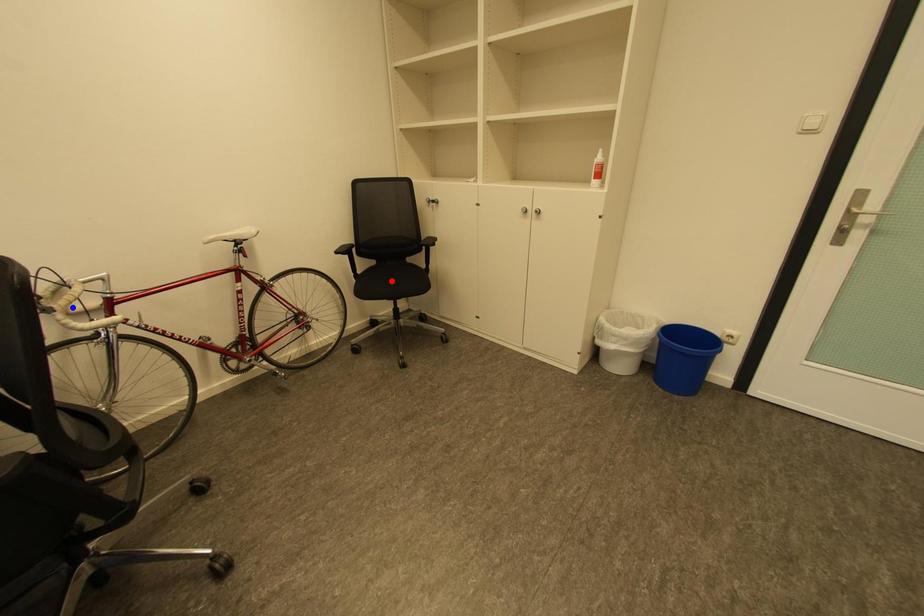
Question: Which of the two points in the image is closer to the camera?

Choices:
 (A) Blue point is closer.
 (B) Red point is closer.

Answer: (A)